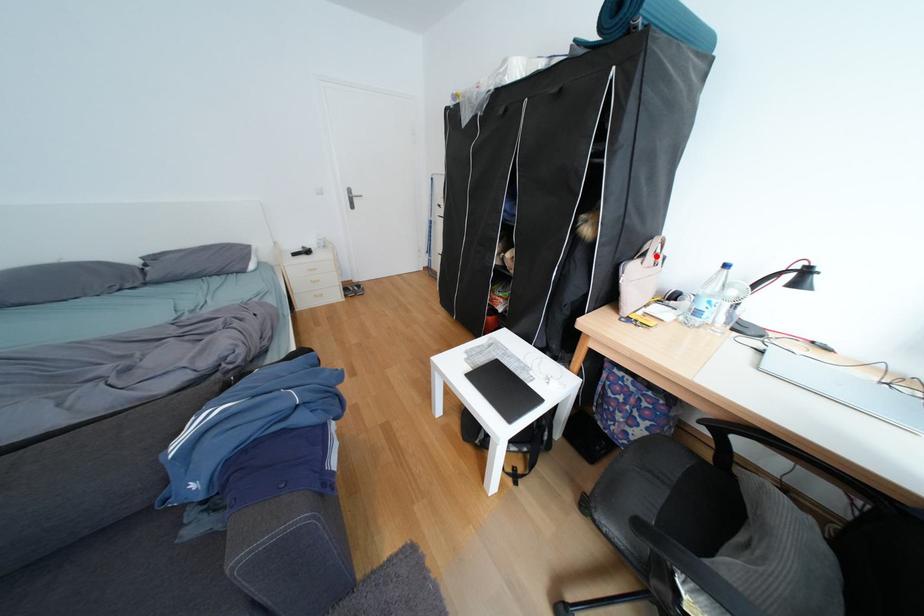
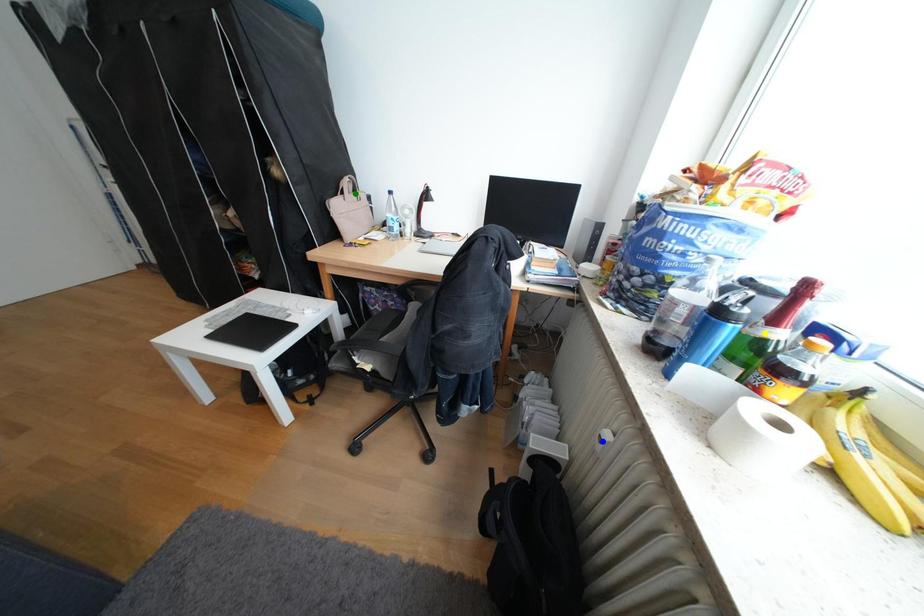
Question: I am providing you with two images of the same scene from different viewpoints. A red point is marked on the first image. You are given multiple points on the second image. Which point in image 2 is actually the same real-world point as the red point in image 1?

Choices:
 (A) green point
 (B) yellow point
 (C) blue point

Answer: (A)